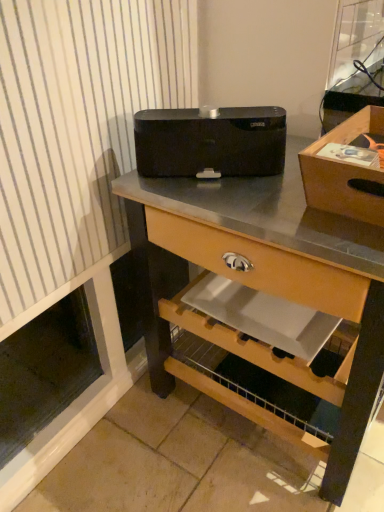
Question: From a real-world perspective, is black matte speaker at center on top of wooden box at upper right?

Choices:
 (A) no
 (B) yes

Answer: (A)

Question: Is the position of black matte speaker at center more distant than that of wooden box at upper right?

Choices:
 (A) yes
 (B) no

Answer: (A)

Question: Does black matte speaker at center have a greater height compared to wooden box at upper right?

Choices:
 (A) no
 (B) yes

Answer: (B)

Question: Would you consider black matte speaker at center to be distant from wooden box at upper right?

Choices:
 (A) yes
 (B) no

Answer: (B)

Question: Is wooden box at upper right at the back of black matte speaker at center?

Choices:
 (A) no
 (B) yes

Answer: (A)

Question: From the image's perspective, would you say black matte speaker at center is positioned over wooden box at upper right?

Choices:
 (A) yes
 (B) no

Answer: (A)

Question: Does wooden box at upper right have a smaller size compared to black matte speaker at center?

Choices:
 (A) yes
 (B) no

Answer: (A)

Question: Is wooden box at upper right wider than black matte speaker at center?

Choices:
 (A) no
 (B) yes

Answer: (A)

Question: Is wooden box at upper right outside black matte speaker at center?

Choices:
 (A) no
 (B) yes

Answer: (B)

Question: Does wooden box at upper right lie in front of black matte speaker at center?

Choices:
 (A) no
 (B) yes

Answer: (A)

Question: Considering the relative sizes of wooden box at upper right and black matte speaker at center in the image provided, is wooden box at upper right bigger than black matte speaker at center?

Choices:
 (A) no
 (B) yes

Answer: (A)

Question: Does wooden box at upper right contain black matte speaker at center?

Choices:
 (A) yes
 (B) no

Answer: (B)

Question: From the image's perspective, is black matte speaker at center over black matte speaker at center?

Choices:
 (A) yes
 (B) no

Answer: (B)